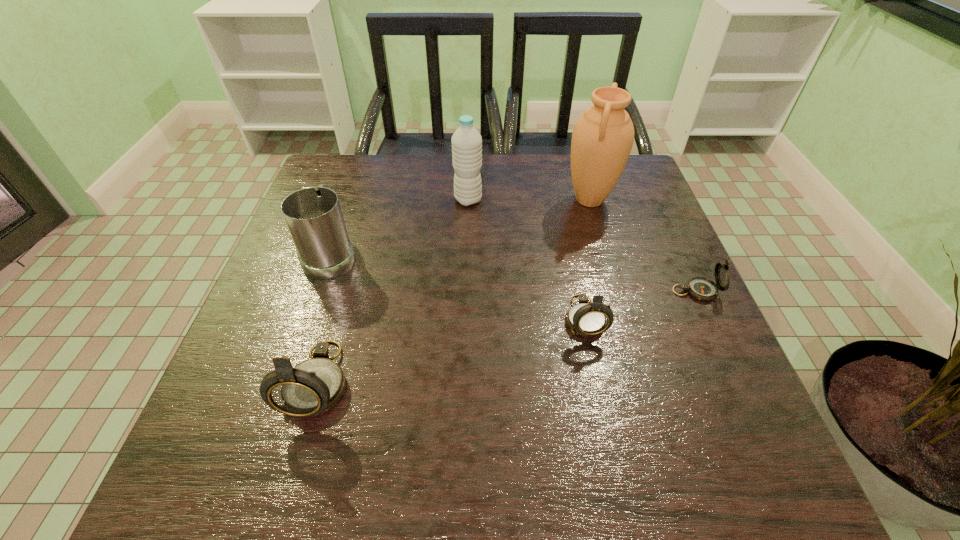
This screenshot has width=960, height=540. In order to click on the leftmost compass in this screenshot , I will do `click(314, 386)`.

Locate an element on the screen. This screenshot has width=960, height=540. the second tallest compass is located at coordinates (585, 319).

Identify the location of the second shortest object. Image resolution: width=960 pixels, height=540 pixels. (585, 319).

Locate an element on the screen. The image size is (960, 540). the shortest compass is located at coordinates (701, 288).

The height and width of the screenshot is (540, 960). I want to click on the rightmost object, so click(701, 288).

The image size is (960, 540). Identify the location of the fourth nearest object. (313, 215).

Locate an element on the screen. the tallest object is located at coordinates (602, 139).

What are the coordinates of `water bottle` in the screenshot? It's located at (466, 141).

The width and height of the screenshot is (960, 540). I want to click on the fifth shortest object, so click(x=466, y=141).

This screenshot has height=540, width=960. In order to click on free location located 0.060m on the face of the second tallest compass in this screenshot , I will do `click(595, 369)`.